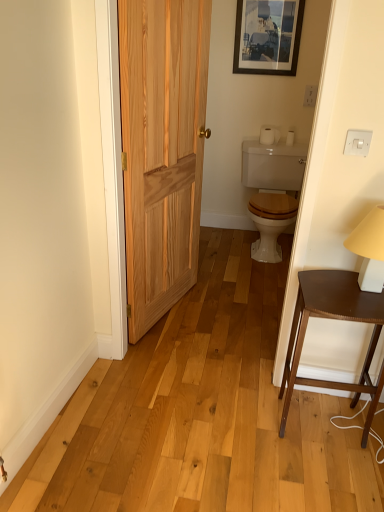
Find the location of a particular element. Image resolution: width=384 pixels, height=512 pixels. free space to the left of dark brown wood table at right is located at coordinates (249, 432).